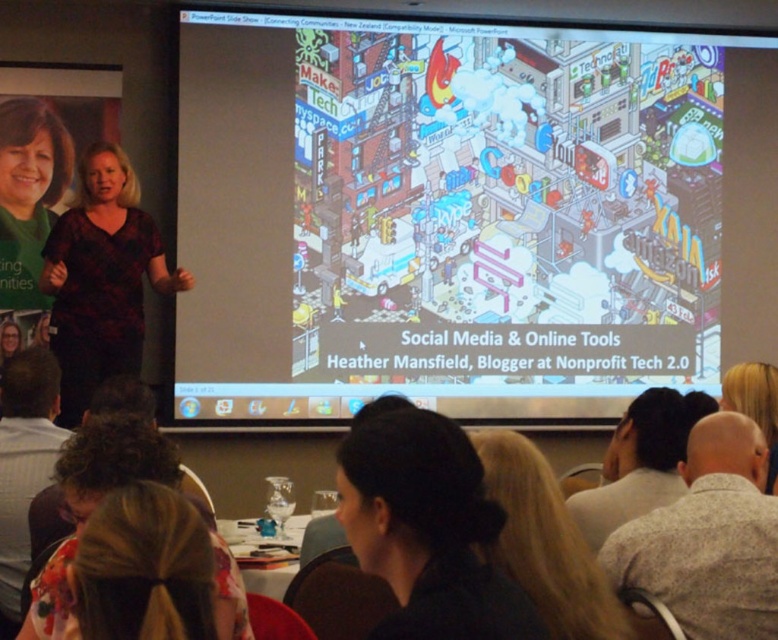
You are an attendee at the presentation and want to know which of the two points, point (12,360) or point (48,125), is closer to you. Can you determine this based on the scene?

Point (12,360) is closer to the viewer than point (48,125).